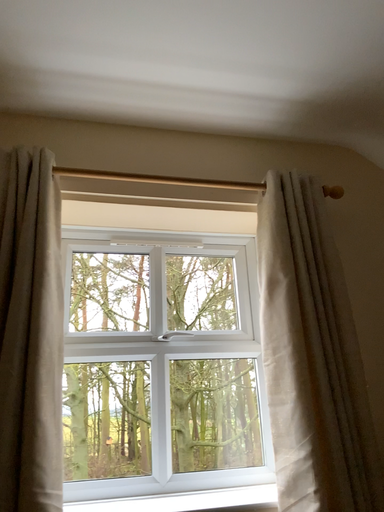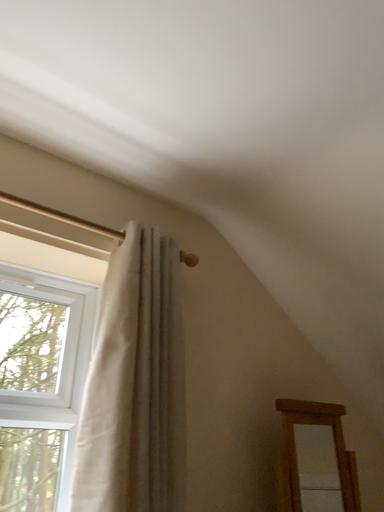
Question: How did the camera likely rotate when shooting the video?

Choices:
 (A) rotated left
 (B) rotated right

Answer: (B)